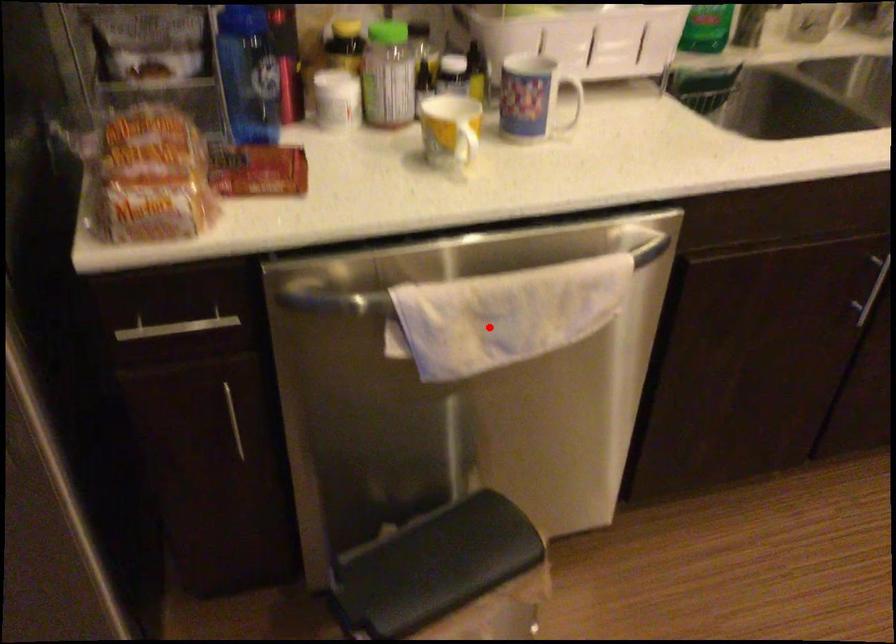
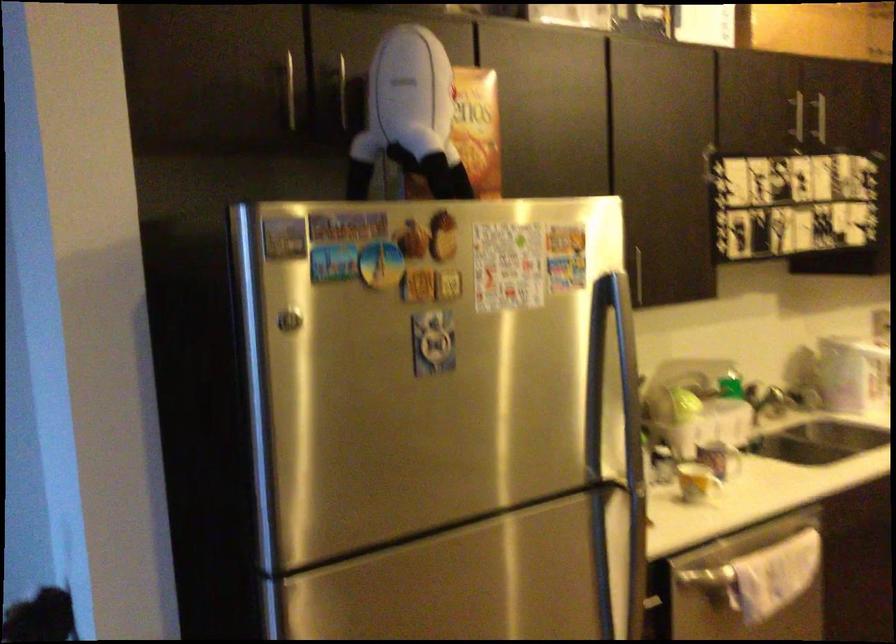
In the second image, find the point that corresponds to the highlighted location in the first image.

(752, 594)